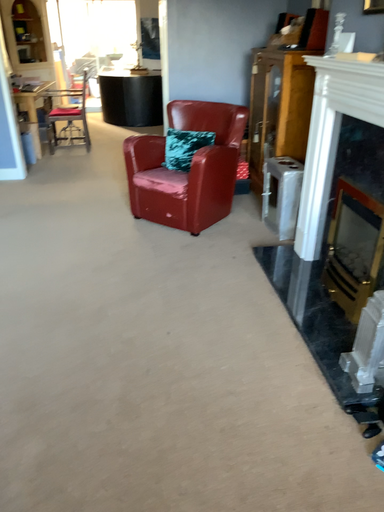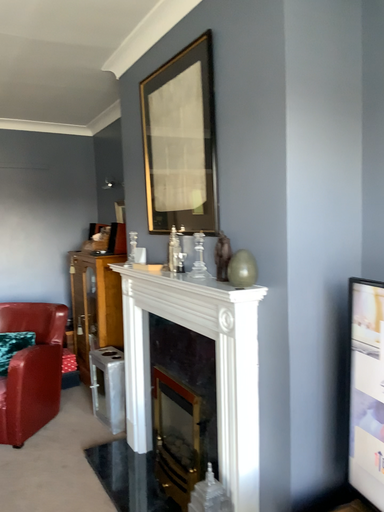
Question: How did the camera likely rotate when shooting the video?

Choices:
 (A) rotated left
 (B) rotated right

Answer: (B)